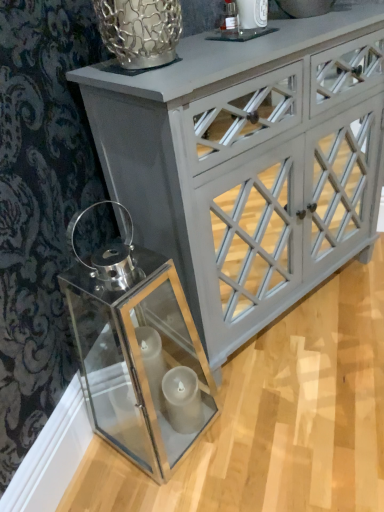
You are a GUI agent. You are given a task and a screenshot of the screen. Output one action in this format:
    pyautogui.click(x=<x>, y=<y>)
    Task: Click on the free space above clear glass lantern at lower left (from a real-world perspective)
    This screenshot has width=384, height=512.
    Given the screenshot: What is the action you would take?
    pyautogui.click(x=75, y=390)